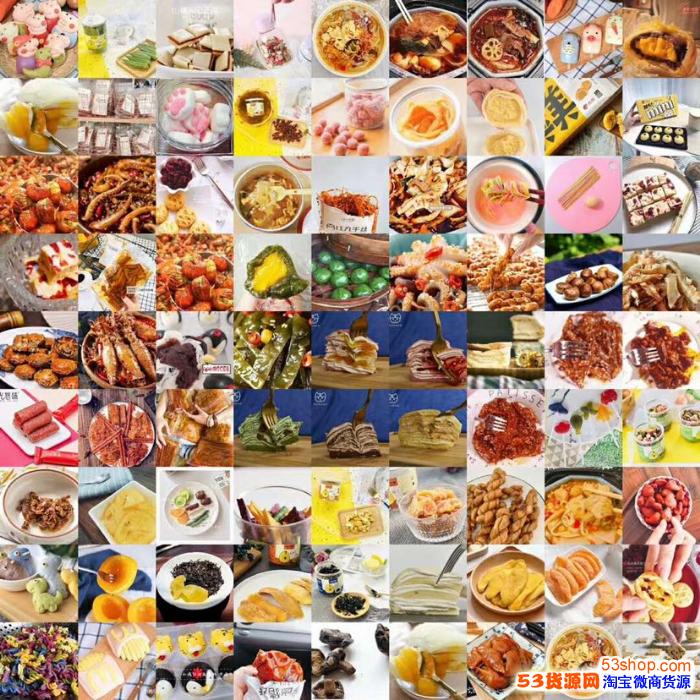
Point to visible these pictures have forks in them in the image. Your answer should be formatted as a list of tuples, i.e. [(x1, y1), (x2, y2), ...], where each tuple contains the x and y coordinates of a point satisfying the conditions above.

[(418, 594), (92, 572), (266, 427), (357, 425), (411, 414), (419, 368), (363, 353), (200, 186)]